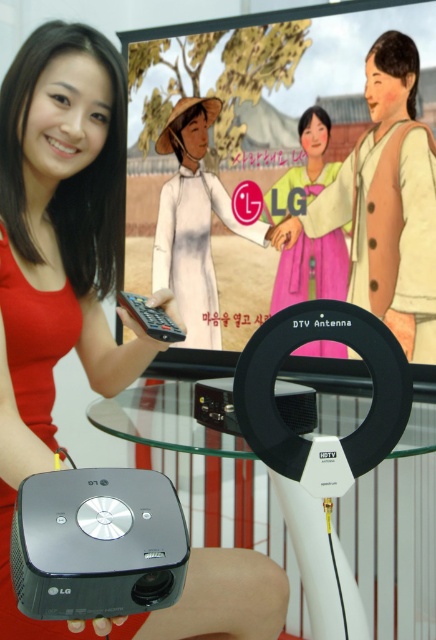
Is point (170, 280) farther from camera compared to point (310, 412)?

That is True.

Can you confirm if matte white dress at center is taller than black plastic antenna at center?

Yes.

Between point (255, 236) and point (218, 419), which one is positioned in front?

Point (218, 419) is in front.

The width and height of the screenshot is (436, 640). I want to click on matte white dress at center, so click(194, 221).

Who is positioned more to the right, pink fabric dress at center or black plastic antenna at center?

pink fabric dress at center is more to the right.

Is point (299, 260) positioned behind point (214, 406)?

Yes, it is.

Image resolution: width=436 pixels, height=640 pixels. Identify the location of pink fabric dress at center. (312, 269).

Where is `pink fabric dress at center`? pink fabric dress at center is located at coordinates (312, 269).

Does matte white dress at center have a lesser width compared to black plastic remote at center?

Incorrect, matte white dress at center's width is not less than black plastic remote at center's.

Does matte white dress at center have a greater height compared to black plastic remote at center?

Yes.

The image size is (436, 640). I want to click on matte white dress at center, so click(x=194, y=221).

Where is `matte white dress at center`? matte white dress at center is located at coordinates (194, 221).